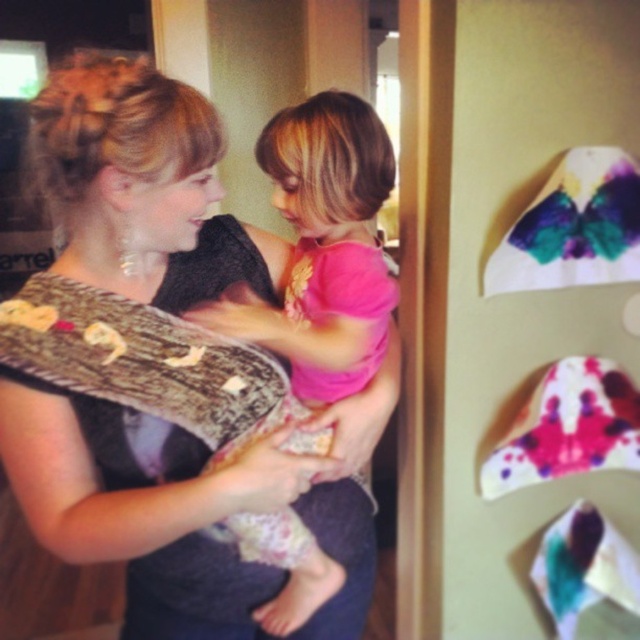
Question: Does matte black dress at center appear on the right side of pink fabric at center?

Choices:
 (A) yes
 (B) no

Answer: (B)

Question: Among these points, which one is nearest to the camera?

Choices:
 (A) (294, 273)
 (B) (76, 481)

Answer: (B)

Question: Which point is farther to the camera?

Choices:
 (A) (93, 449)
 (B) (330, 234)

Answer: (B)

Question: Does matte black dress at center appear over pink fabric at center?

Choices:
 (A) yes
 (B) no

Answer: (B)

Question: Does matte black dress at center have a larger size compared to pink fabric at center?

Choices:
 (A) yes
 (B) no

Answer: (A)